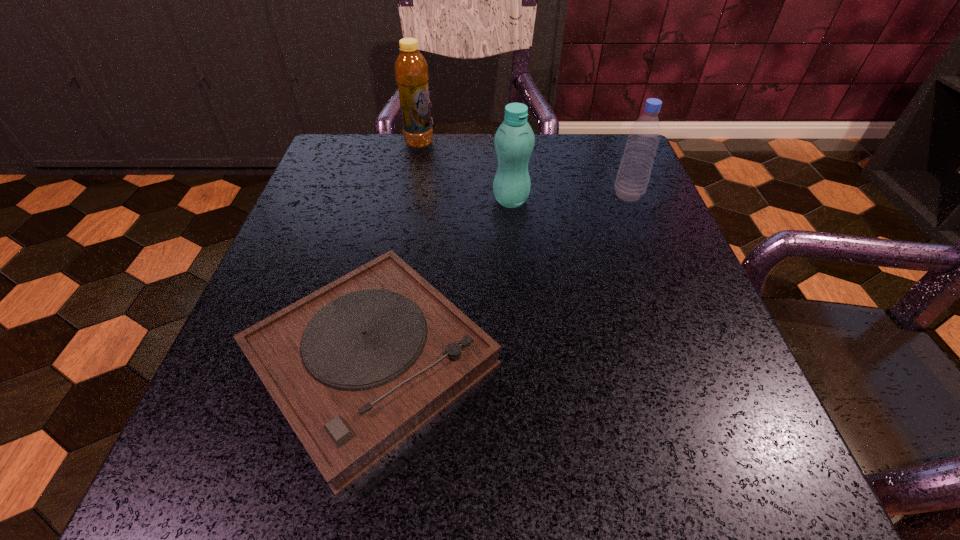
In the image, there is a desktop. Where is `vacant space at the far right corner`? This screenshot has width=960, height=540. vacant space at the far right corner is located at coordinates (608, 178).

You are a GUI agent. You are given a task and a screenshot of the screen. Output one action in this format:
    pyautogui.click(x=<x>, y=<y>)
    Task: Click on the free space at the near right corner of the desktop
    The height and width of the screenshot is (540, 960).
    Given the screenshot: What is the action you would take?
    pyautogui.click(x=718, y=486)

I want to click on free space between the rightmost object and the phonograph record, so click(499, 278).

This screenshot has width=960, height=540. I want to click on unoccupied area between the second bottle from left to right and the nearest object, so click(x=442, y=280).

The height and width of the screenshot is (540, 960). Find the location of `free spot between the rightmost object and the second bottle from left to right`. free spot between the rightmost object and the second bottle from left to right is located at coordinates (569, 198).

Locate an element on the screen. The width and height of the screenshot is (960, 540). free space between the second bottle from right to left and the rightmost bottle is located at coordinates (569, 198).

Image resolution: width=960 pixels, height=540 pixels. I want to click on vacant space that's between the leftmost bottle and the nearest object, so click(396, 252).

Locate an element on the screen. This screenshot has height=540, width=960. empty space that is in between the second bottle from left to right and the farthest object is located at coordinates (465, 172).

Locate an element on the screen. The height and width of the screenshot is (540, 960). empty location between the second bottle from right to left and the rightmost object is located at coordinates (569, 198).

I want to click on vacant area that lies between the second bottle from left to right and the shortest object, so click(442, 280).